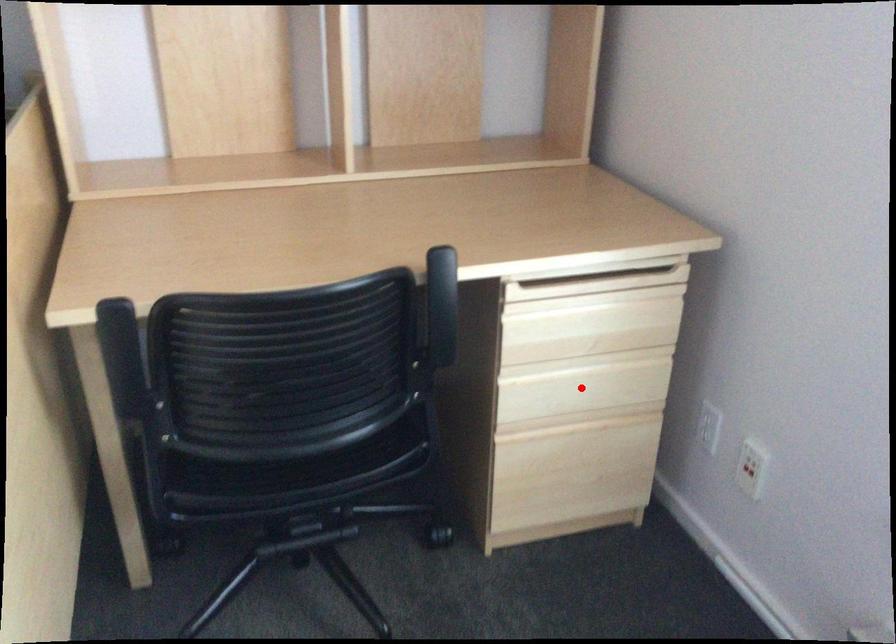
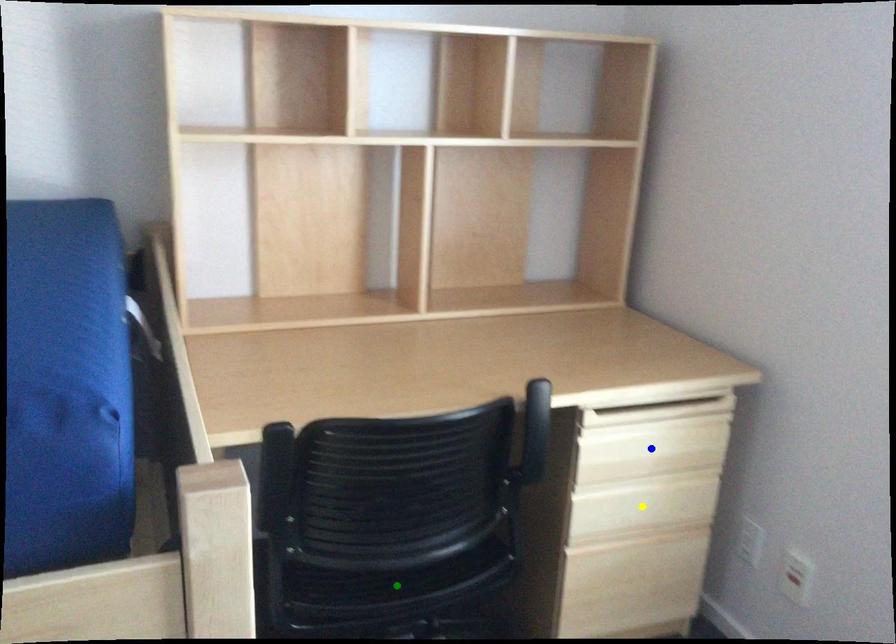
Question: I am providing you with two images of the same scene from different viewpoints. A red point is marked on the first image. You are given multiple points on the second image. In image 2, which mark is for the same physical point as the one in image 1?

Choices:
 (A) blue point
 (B) yellow point
 (C) green point

Answer: (B)